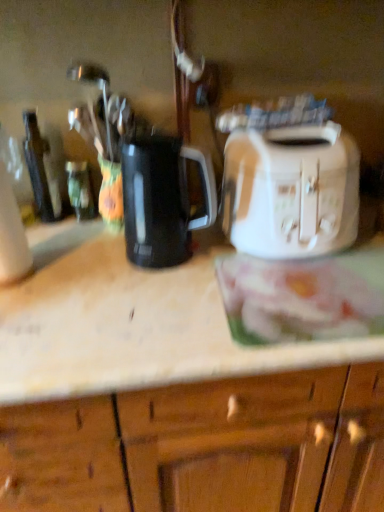
Locate an element on the screen. The height and width of the screenshot is (512, 384). dark brown glass bottle at left, acting as the first bottle starting from the left is located at coordinates (41, 170).

What do you see at coordinates (303, 297) in the screenshot?
I see `white glossy bread at center` at bounding box center [303, 297].

Measure the distance between white glossy bread at center and camera.

white glossy bread at center is 27.30 inches away from camera.

This screenshot has width=384, height=512. Describe the element at coordinates (81, 190) in the screenshot. I see `green glass bottle at left, which is counted as the 2th bottle, starting from the left` at that location.

This screenshot has height=512, width=384. What do you see at coordinates (162, 199) in the screenshot?
I see `black plastic kettle at center` at bounding box center [162, 199].

Identify the location of white glossy toaster at upper right. (129, 323).

Where is `dark brown glass bottle at left, which appears as the second bottle when viewed from the right`? dark brown glass bottle at left, which appears as the second bottle when viewed from the right is located at coordinates (41, 170).

Which is more to the left, black plastic kettle at center or dark brown glass bottle at left, which appears as the second bottle when viewed from the right?

dark brown glass bottle at left, which appears as the second bottle when viewed from the right.

This screenshot has width=384, height=512. Find the location of `kitchen appliance on the right of dark brown glass bottle at left, acting as the first bottle starting from the left`. kitchen appliance on the right of dark brown glass bottle at left, acting as the first bottle starting from the left is located at coordinates (162, 199).

From the image's perspective, is black plastic kettle at center under dark brown glass bottle at left, acting as the first bottle starting from the left?

Indeed, from the image's perspective, black plastic kettle at center is shown beneath dark brown glass bottle at left, acting as the first bottle starting from the left.

Considering the sizes of black plastic kettle at center and dark brown glass bottle at left, which appears as the second bottle when viewed from the right, in the image, is black plastic kettle at center bigger or smaller than dark brown glass bottle at left, which appears as the second bottle when viewed from the right,?

In the image, black plastic kettle at center appears to be larger than dark brown glass bottle at left, which appears as the second bottle when viewed from the right.

Does point (142, 327) come farther from viewer compared to point (321, 283)?

No, (142, 327) is in front of (321, 283).

In the scene shown: How distant is white glossy toaster at upper right from white glossy bread at center?

white glossy toaster at upper right and white glossy bread at center are 5.73 inches apart from each other.

Is white glossy toaster at upper right at the left side of white glossy bread at center?

Correct, you'll find white glossy toaster at upper right to the left of white glossy bread at center.

Is white glossy toaster at upper right with white glossy bread at center?

white glossy toaster at upper right is not next to white glossy bread at center, and they're not touching.

From the image's perspective, is white plastic toaster at right above or below white glossy toaster at upper right?

white plastic toaster at right is situated higher than white glossy toaster at upper right in the image.

Looking at this image, considering the relative sizes of white plastic toaster at right and white glossy toaster at upper right in the image provided, is white plastic toaster at right shorter than white glossy toaster at upper right?

Yes.

Measure the distance between white plastic toaster at right and white glossy toaster at upper right.

white plastic toaster at right and white glossy toaster at upper right are 10.84 inches apart.

Looking at this image, which object is further away from the camera, white plastic toaster at right or white glossy toaster at upper right?

white plastic toaster at right is more distant.

Can you tell me how much white glossy bread at center and green glass bottle at left, which is counted as the 2th bottle, starting from the left, differ in facing direction?

2.42 degrees.

From the picture: Considering the sizes of objects white glossy bread at center and green glass bottle at left, the 1th bottle viewed from the right, in the image provided, who is shorter, white glossy bread at center or green glass bottle at left, the 1th bottle viewed from the right,?

white glossy bread at center is shorter.

Which is correct: white glossy bread at center is inside green glass bottle at left, which is counted as the 2th bottle, starting from the left, or outside of it?

white glossy bread at center cannot be found inside green glass bottle at left, which is counted as the 2th bottle, starting from the left.

Looking at this image, which is more to the left, white glossy bread at center or green glass bottle at left, which is counted as the 2th bottle, starting from the left?

Positioned to the left is green glass bottle at left, which is counted as the 2th bottle, starting from the left.

Between white glossy bread at center and white glossy toaster at upper right, which one has smaller width?

white glossy bread at center is thinner.

Who is bigger, white glossy bread at center or white glossy toaster at upper right?

Bigger between the two is white glossy toaster at upper right.

Is white glossy bread at center oriented away from white glossy toaster at upper right?

Yes, white glossy bread at center is positioned with its back facing white glossy toaster at upper right.

From a real-world perspective, does white glossy toaster at upper right stand above white plastic toaster at right?

Incorrect, from a real-world perspective, white glossy toaster at upper right is lower than white plastic toaster at right.

From the image's perspective, which is below, white glossy toaster at upper right or white plastic toaster at right?

white glossy toaster at upper right.

At what (x,y) coordinates should I click in order to perform the action: click on countertop on the left side of white plastic toaster at right. Please return your answer as a coordinate pair (x, y). Looking at the image, I should click on (129, 323).

Is dark brown glass bottle at left, acting as the first bottle starting from the left, positioned with its back to white glossy bread at center?

No, dark brown glass bottle at left, acting as the first bottle starting from the left, is not facing away from white glossy bread at center.

Is dark brown glass bottle at left, which appears as the second bottle when viewed from the right, behind white glossy bread at center?

Yes.

Does dark brown glass bottle at left, which appears as the second bottle when viewed from the right, have a larger size compared to white glossy bread at center?

Actually, dark brown glass bottle at left, which appears as the second bottle when viewed from the right, might be smaller than white glossy bread at center.

Could you measure the distance between dark brown glass bottle at left, acting as the first bottle starting from the left, and white glossy bread at center?

dark brown glass bottle at left, acting as the first bottle starting from the left, and white glossy bread at center are 24.54 inches apart.

This screenshot has height=512, width=384. Find the location of `kitchen appliance located in front of the dark brown glass bottle at left, which appears as the second bottle when viewed from the right`. kitchen appliance located in front of the dark brown glass bottle at left, which appears as the second bottle when viewed from the right is located at coordinates 162,199.

The height and width of the screenshot is (512, 384). There is a white glossy toaster at upper right. Find the location of `food above it (from a real-world perspective)`. food above it (from a real-world perspective) is located at coordinates (303, 297).

Looking at the image, which one is located further to black plastic kettle at center, white glossy toaster at upper right or green glass bottle at left, which is counted as the 2th bottle, starting from the left?

Among the two, green glass bottle at left, which is counted as the 2th bottle, starting from the left, is located further to black plastic kettle at center.

Estimate the real-world distances between objects in this image. Which object is further from black plastic kettle at center, white glossy bread at center or green glass bottle at left, which is counted as the 2th bottle, starting from the left?

green glass bottle at left, which is counted as the 2th bottle, starting from the left, lies further to black plastic kettle at center than the other object.

When comparing their distances from white plastic toaster at right, does white glossy toaster at upper right or white glossy bread at center seem closer?

white glossy bread at center is positioned closer to the anchor white plastic toaster at right.

When comparing their distances from dark brown glass bottle at left, which appears as the second bottle when viewed from the right, does black plastic kettle at center or white glossy bread at center seem further?

white glossy bread at center lies further to dark brown glass bottle at left, which appears as the second bottle when viewed from the right, than the other object.

Based on their spatial positions, is white glossy bread at center or dark brown glass bottle at left, acting as the first bottle starting from the left, further from white plastic toaster at right?

dark brown glass bottle at left, acting as the first bottle starting from the left, lies further to white plastic toaster at right than the other object.

Looking at the image, which one is located closer to white plastic toaster at right, black plastic kettle at center or dark brown glass bottle at left, acting as the first bottle starting from the left?

Among the two, black plastic kettle at center is located nearer to white plastic toaster at right.

Considering their positions, is black plastic kettle at center positioned further to white plastic toaster at right than white glossy bread at center?

Among the two, black plastic kettle at center is located further to white plastic toaster at right.

When comparing their distances from dark brown glass bottle at left, which appears as the second bottle when viewed from the right, does green glass bottle at left, which is counted as the 2th bottle, starting from the left, or white glossy toaster at upper right seem closer?

green glass bottle at left, which is counted as the 2th bottle, starting from the left, lies closer to dark brown glass bottle at left, which appears as the second bottle when viewed from the right, than the other object.

The width and height of the screenshot is (384, 512). Identify the location of toaster between dark brown glass bottle at left, acting as the first bottle starting from the left, and white glossy toaster at upper right from top to bottom. (291, 191).

Identify the location of toaster between green glass bottle at left, the 1th bottle viewed from the right, and white glossy bread at center. (291, 191).

Locate an element on the screen. food between white plastic toaster at right and white glossy toaster at upper right in the up-down direction is located at coordinates point(303,297).

Where is `bottle between dark brown glass bottle at left, acting as the first bottle starting from the left, and white glossy toaster at upper right, in the vertical direction`? The width and height of the screenshot is (384, 512). bottle between dark brown glass bottle at left, acting as the first bottle starting from the left, and white glossy toaster at upper right, in the vertical direction is located at coordinates (81, 190).